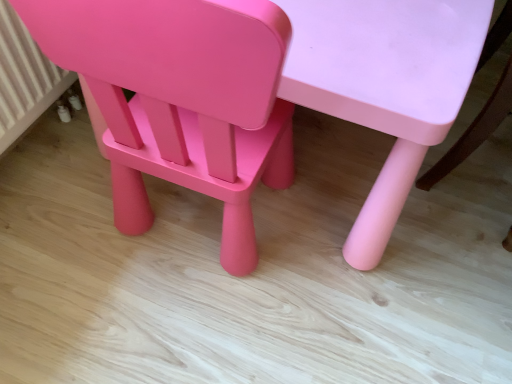
This screenshot has width=512, height=384. I want to click on matte plastic chair at center, so click(181, 99).

Describe the element at coordinates (181, 99) in the screenshot. The image size is (512, 384). I see `matte plastic chair at center` at that location.

Locate an element on the screen. Image resolution: width=512 pixels, height=384 pixels. matte plastic chair at center is located at coordinates (181, 99).